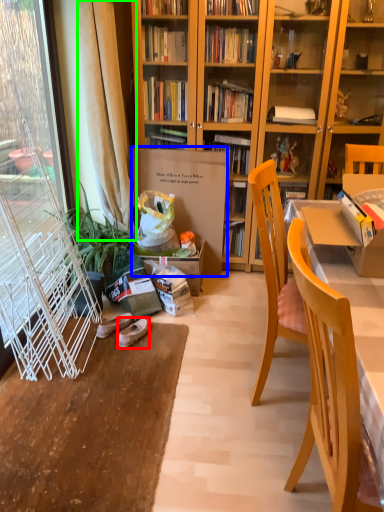
Question: Considering the real-world distances, which object is closest to footwear (highlighted by a red box)? cardboard box (highlighted by a blue box) or curtain (highlighted by a green box).

Choices:
 (A) cardboard box
 (B) curtain

Answer: (A)